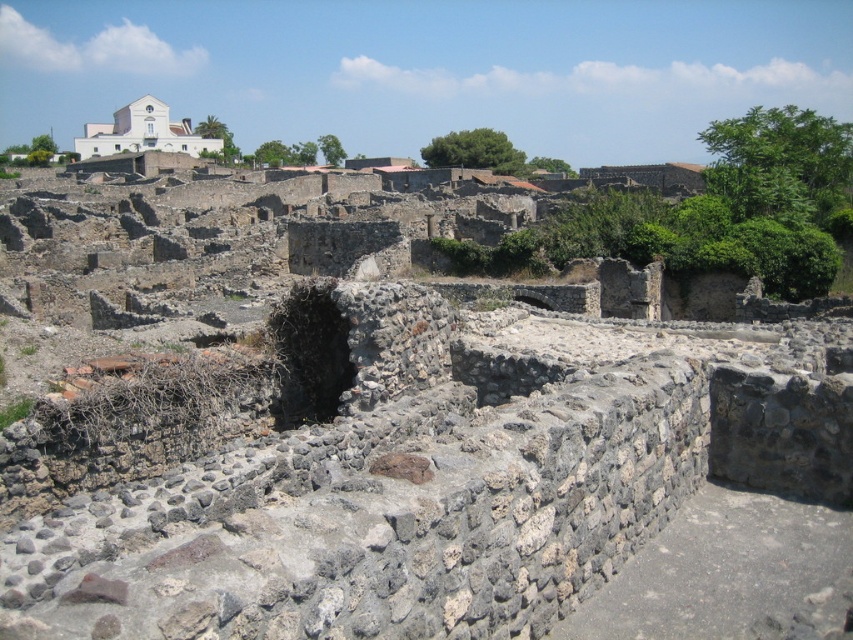
Describe the element at coordinates (308, 353) in the screenshot. I see `dark stone hole at center` at that location.

Can you confirm if dark stone hole at center is positioned to the left of white stone building at upper left?

Incorrect, dark stone hole at center is not on the left side of white stone building at upper left.

Locate an element on the screen. The height and width of the screenshot is (640, 853). dark stone hole at center is located at coordinates (308, 353).